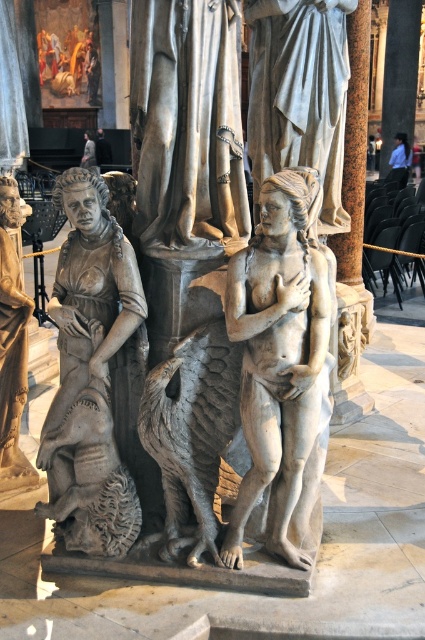
Which of these two, smooth stone statue at center or matte gray statue at left, stands shorter?

matte gray statue at left

Locate an element on the screen. smooth stone statue at center is located at coordinates (278, 355).

Between point (22, 340) and point (390, 13), which one is positioned behind?

The point (390, 13) is behind.

Who is positioned more to the right, matte gray statue at left or smooth stone column at center?

Positioned to the right is smooth stone column at center.

Who is more distant from viewer, (2, 232) or (385, 147)?

The point (385, 147) is behind.

Image resolution: width=425 pixels, height=640 pixels. In order to click on matte gray statue at left in this screenshot , I will do `click(11, 346)`.

Which is above, smooth stone statue at center or blue fabric shirt at upper right?

blue fabric shirt at upper right

Is smooth stone statue at center to the left of blue fabric shirt at upper right from the viewer's perspective?

Indeed, smooth stone statue at center is positioned on the left side of blue fabric shirt at upper right.

Who is more distant from viewer, (277, 342) or (410, 152)?

The point (410, 152) is more distant.

The width and height of the screenshot is (425, 640). I want to click on smooth stone statue at center, so (278, 355).